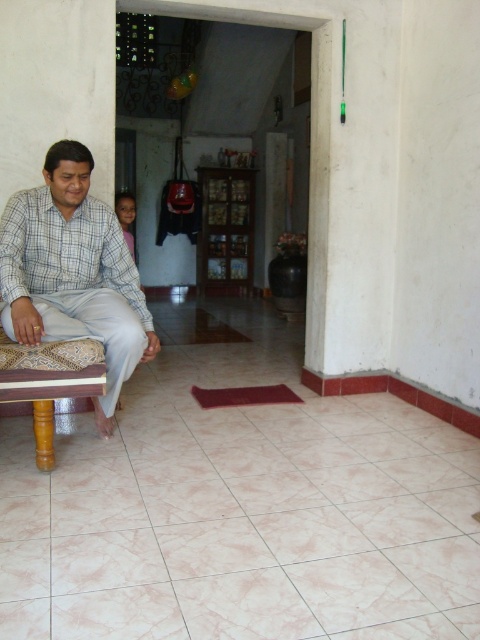
Question: Does wooden stool at left have a larger size compared to dark skin boy at center?

Choices:
 (A) no
 (B) yes

Answer: (A)

Question: Among these objects, which one is nearest to the camera?

Choices:
 (A) dark skin boy at center
 (B) checkered fabric shirt at left
 (C) wooden stool at left

Answer: (C)

Question: Which of these objects is positioned farthest from the wooden stool at left?

Choices:
 (A) dark skin boy at center
 (B) checkered fabric shirt at left

Answer: (A)

Question: Is checkered fabric shirt at left in front of wooden stool at left?

Choices:
 (A) no
 (B) yes

Answer: (A)

Question: Does checkered fabric shirt at left appear over wooden stool at left?

Choices:
 (A) yes
 (B) no

Answer: (A)

Question: Among these objects, which one is nearest to the camera?

Choices:
 (A) dark skin boy at center
 (B) wooden stool at left
 (C) checkered fabric shirt at left

Answer: (B)